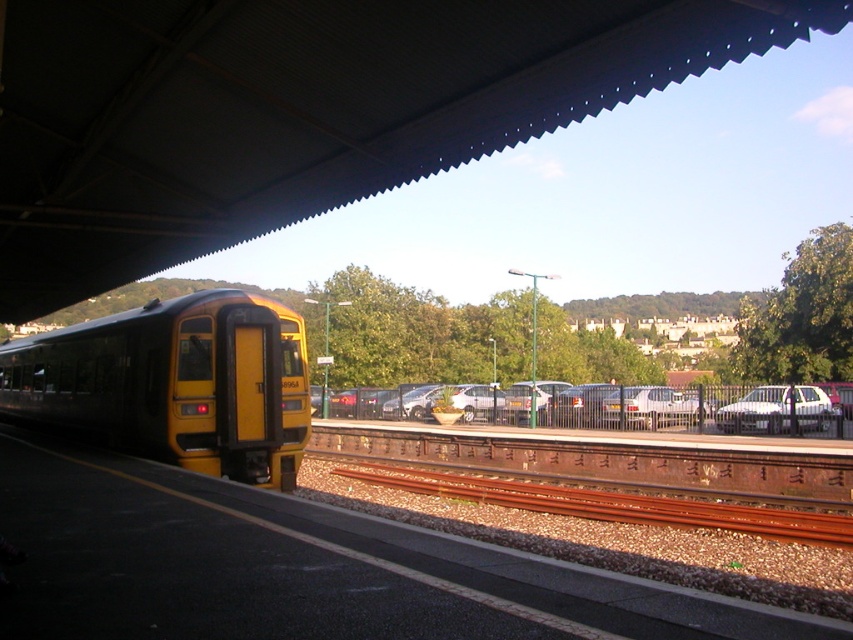
You are a passenger waiting at the train station platform. You see the yellow matte train at left and the white matte car at center. Which one is closer to the edge of the platform marked by the white safety line?

The yellow matte train at left is closer to the edge of the platform marked by the white safety line because it is positioned to the left of the white matte car at center, and the edge of the platform is on the left side where the train is located.

You are a passenger waiting at the train station platform. You need to board the yellow matte train at left. Where should you stand relative to the safety line to ensure you can see the train clearly?

Since the yellow matte train at left is positioned at point (175, 384), you should stand behind the safety line to maintain a clear view of the train and ensure your safety while waiting.

You are a passenger waiting on the platform at the train station. You see the yellow matte train at left and the white matte car at center. Which one is bigger?

The yellow matte train at left is larger in size than the white matte car at center.